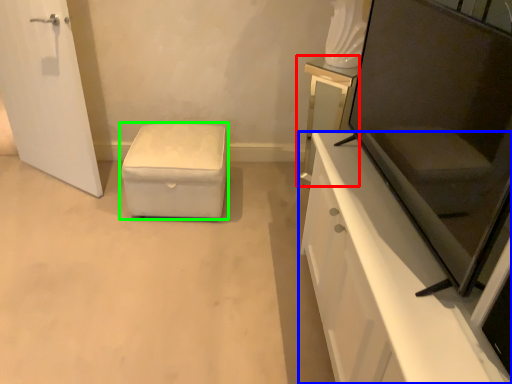
Question: Based on their relative distances, which object is nearer to vanity (highlighted by a red box)? Choose from cabinetry (highlighted by a blue box) and furniture (highlighted by a green box).

Choices:
 (A) cabinetry
 (B) furniture

Answer: (A)